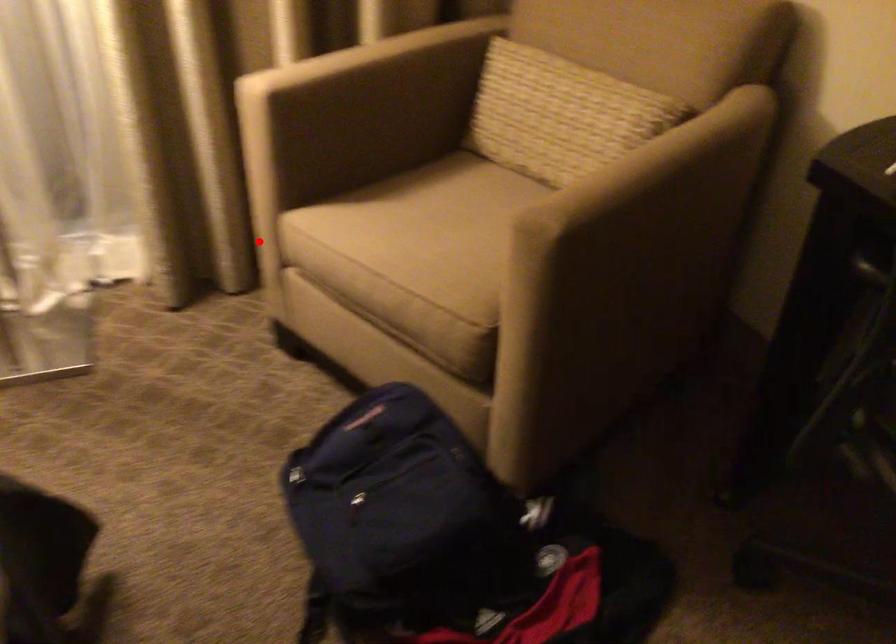
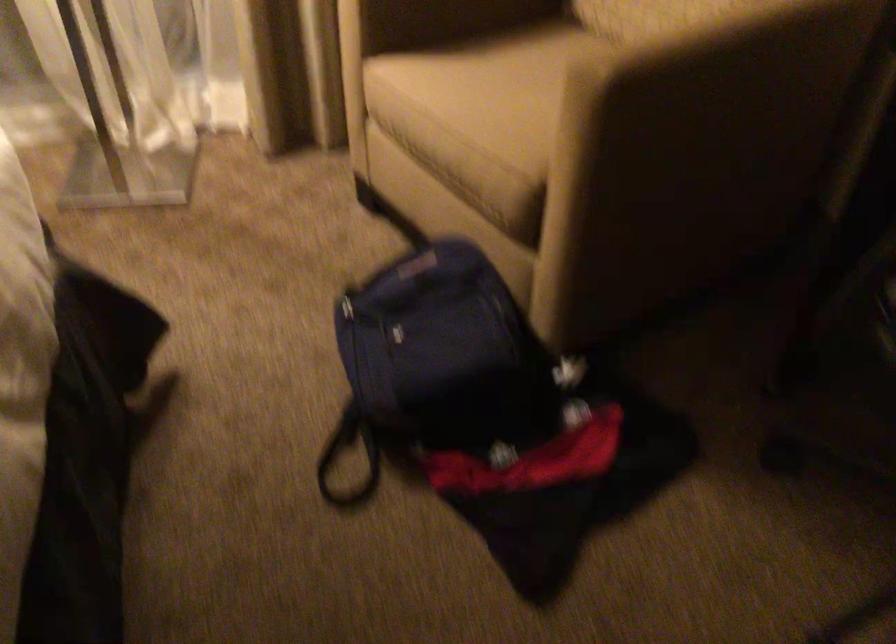
Find the pixel in the second image that matches the highlighted location in the first image.

(343, 90)